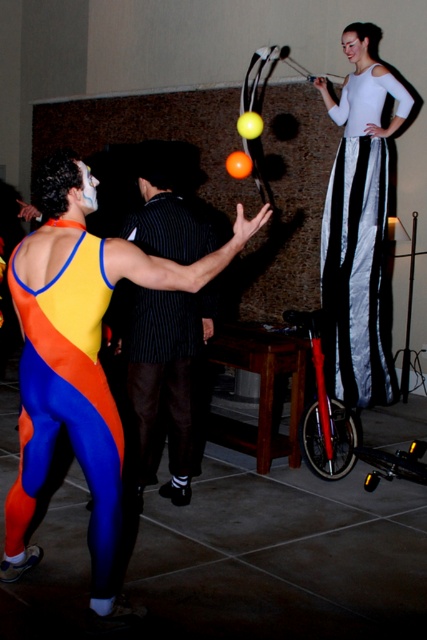
Question: Which point is closer to the camera?

Choices:
 (A) pyautogui.click(x=181, y=301)
 (B) pyautogui.click(x=336, y=320)

Answer: (A)

Question: Considering the real-world distances, which object is closest to the white matte/uniform at center?

Choices:
 (A) white satin pants at upper right
 (B) black striped suit at center

Answer: (B)

Question: Among these points, which one is nearest to the camera?

Choices:
 (A) (383, 332)
 (B) (155, 378)

Answer: (B)

Question: Does white satin pants at upper right lie behind black striped suit at center?

Choices:
 (A) yes
 (B) no

Answer: (A)

Question: Is white satin pants at upper right smaller than black striped suit at center?

Choices:
 (A) yes
 (B) no

Answer: (B)

Question: Is white satin pants at upper right wider than black striped suit at center?

Choices:
 (A) yes
 (B) no

Answer: (A)